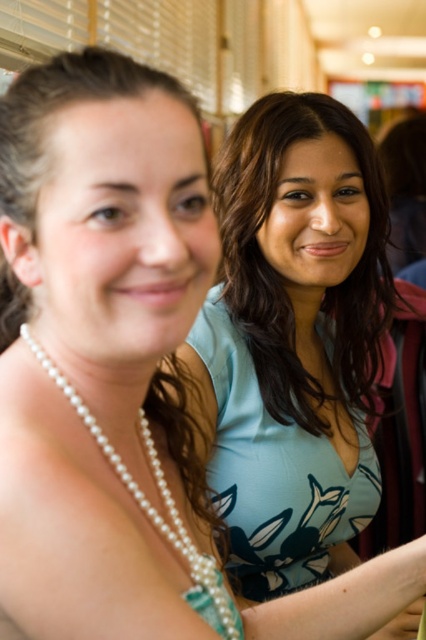
You are standing in the mall and see two points in the image. Which point is closer to you, point (253,189) or point (16,180)?

Point (16,180) is closer to you because it is less further to the camera than point (253,189).

You are a photographer trying to capture both the pearl necklace at left and the pearl necklace at center in a single shot. Which necklace should you focus on first to ensure both are in clear view?

You should focus on the pearl necklace at left first because it is closer to the viewer, ensuring both necklaces will be in clear view when focused on the closer one.